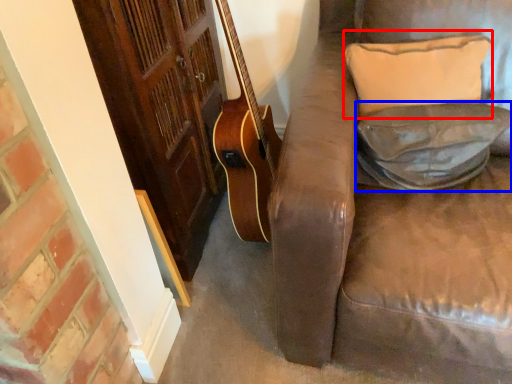
Question: Which object appears closest to the camera in this image, pillow (highlighted by a red box) or pillow (highlighted by a blue box)?

Choices:
 (A) pillow
 (B) pillow

Answer: (B)